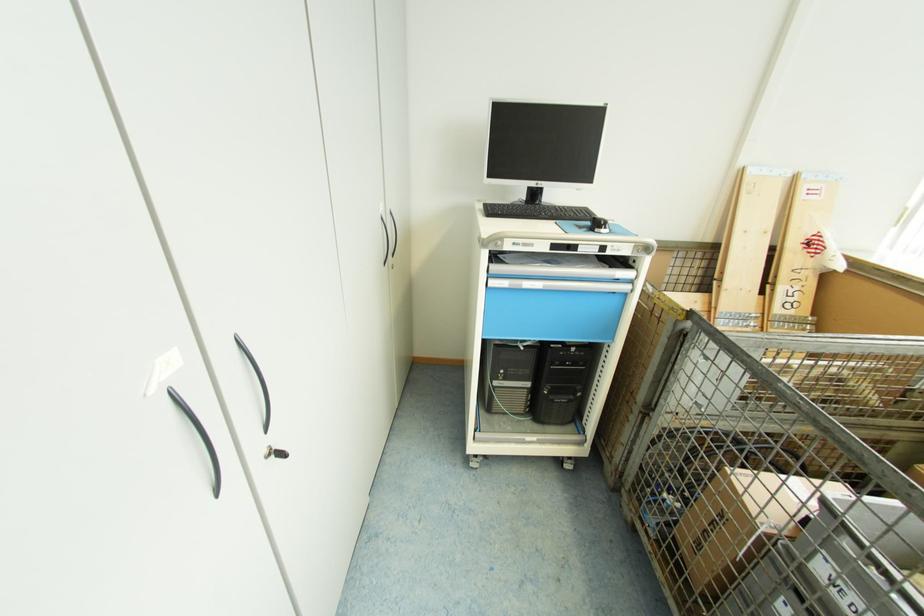
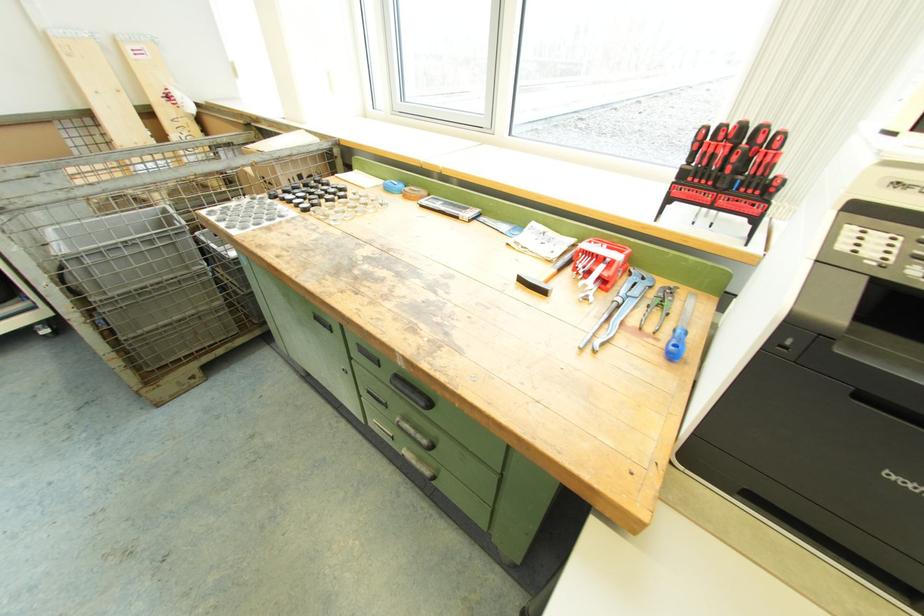
In the second image, find the point that corresponds to (x=574, y=461) in the first image.

(43, 326)